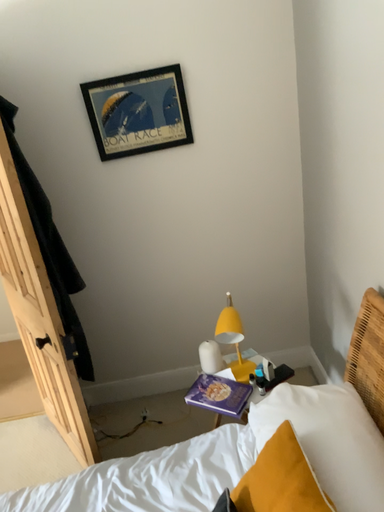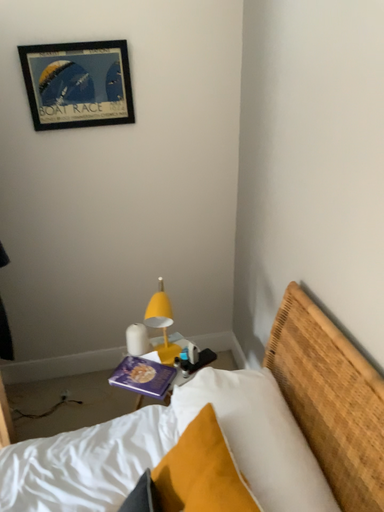
Question: How did the camera likely rotate when shooting the video?

Choices:
 (A) rotated right
 (B) rotated left

Answer: (A)